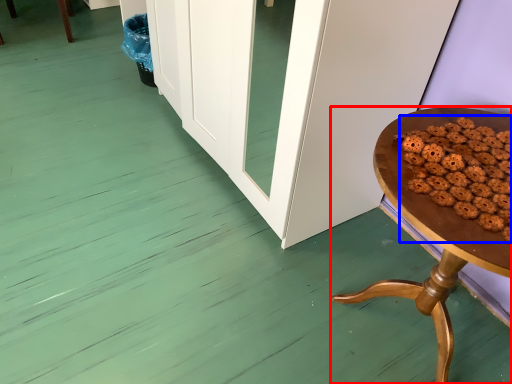
Question: Which point is closer to the camera, table (highlighted by a red box) or food (highlighted by a blue box)?

Choices:
 (A) table
 (B) food

Answer: (A)